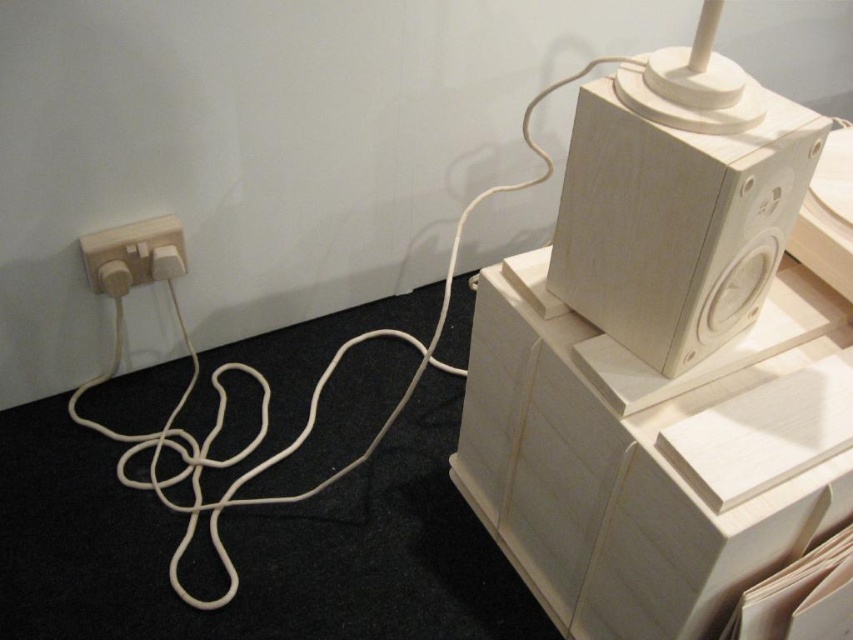
Question: Is wooden speaker at upper right smaller than white matte rope at lower left?

Choices:
 (A) yes
 (B) no

Answer: (A)

Question: Which point is farther to the camera?

Choices:
 (A) wooden speaker at upper right
 (B) white matte rope at lower left
 (C) white matte electrical outlet at lower left

Answer: (C)

Question: Does wooden speaker at upper right have a smaller size compared to white matte electrical outlet at lower left?

Choices:
 (A) yes
 (B) no

Answer: (B)

Question: Which point is farther to the camera?

Choices:
 (A) (177, 429)
 (B) (161, 218)
 (C) (637, 120)

Answer: (A)

Question: Does wooden speaker at upper right have a smaller size compared to white matte electrical outlet at lower left?

Choices:
 (A) no
 (B) yes

Answer: (A)

Question: Which object is positioned farthest from the white matte electrical outlet at lower left?

Choices:
 (A) wooden speaker at upper right
 (B) white matte rope at lower left

Answer: (A)